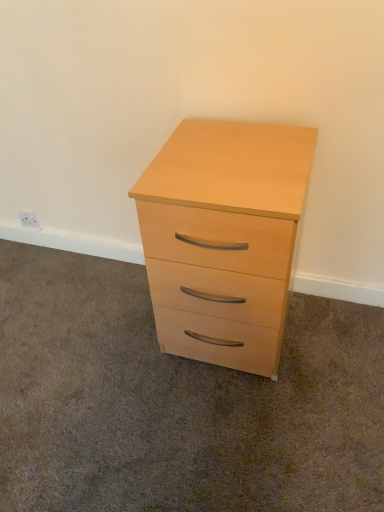
The height and width of the screenshot is (512, 384). Find the location of `free space to the right of light wood chest of drawers at center`. free space to the right of light wood chest of drawers at center is located at coordinates (329, 343).